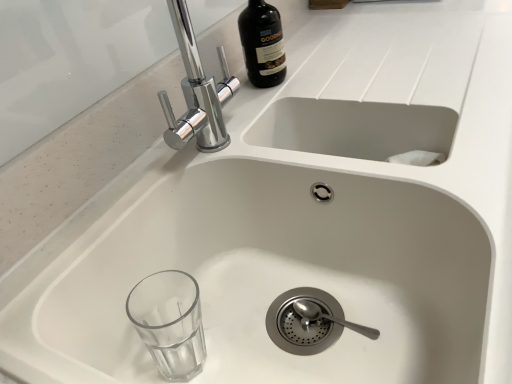
What is the approximate width of dark brown glass bottle at upper center?

It is 4.78 inches.

Where is `dark brown glass bottle at upper center`? The height and width of the screenshot is (384, 512). dark brown glass bottle at upper center is located at coordinates (262, 44).

Describe the element at coordinates (262, 44) in the screenshot. I see `dark brown glass bottle at upper center` at that location.

Locate an element on the screen. This screenshot has height=384, width=512. dark brown glass bottle at upper center is located at coordinates (262, 44).